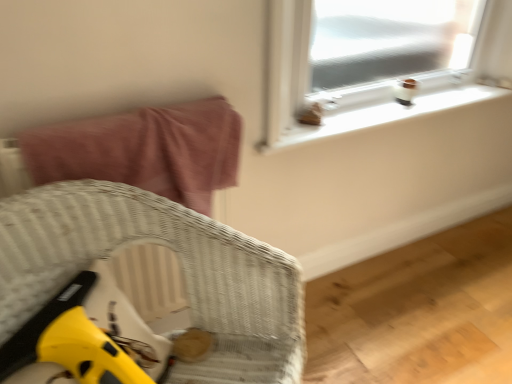
Question: Should I look upward or downward to see woven wicker chair at lower left?

Choices:
 (A) down
 (B) up

Answer: (A)

Question: From a real-world perspective, is white plastic window sill at upper right physically below pink fabric bed at upper left?

Choices:
 (A) no
 (B) yes

Answer: (B)

Question: Is white plastic window sill at upper right to the right of pink fabric bed at upper left from the viewer's perspective?

Choices:
 (A) no
 (B) yes

Answer: (B)

Question: From the image's perspective, is white plastic window sill at upper right over pink fabric bed at upper left?

Choices:
 (A) yes
 (B) no

Answer: (A)

Question: Considering the relative sizes of white plastic window sill at upper right and pink fabric bed at upper left in the image provided, is white plastic window sill at upper right thinner than pink fabric bed at upper left?

Choices:
 (A) no
 (B) yes

Answer: (B)

Question: Is white plastic window sill at upper right with pink fabric bed at upper left?

Choices:
 (A) no
 (B) yes

Answer: (A)

Question: Can you confirm if white plastic window sill at upper right is positioned to the left of pink fabric bed at upper left?

Choices:
 (A) no
 (B) yes

Answer: (A)

Question: Does woven wicker chair at lower left have a greater height compared to white plastic window sill at upper right?

Choices:
 (A) no
 (B) yes

Answer: (B)

Question: Considering the relative sizes of woven wicker chair at lower left and white plastic window sill at upper right in the image provided, is woven wicker chair at lower left smaller than white plastic window sill at upper right?

Choices:
 (A) yes
 (B) no

Answer: (B)

Question: From the image's perspective, is woven wicker chair at lower left located above white plastic window sill at upper right?

Choices:
 (A) yes
 (B) no

Answer: (B)

Question: From a real-world perspective, is woven wicker chair at lower left on top of white plastic window sill at upper right?

Choices:
 (A) no
 (B) yes

Answer: (A)

Question: Could you tell me if woven wicker chair at lower left is facing white plastic window sill at upper right?

Choices:
 (A) no
 (B) yes

Answer: (A)

Question: Is the surface of woven wicker chair at lower left in direct contact with white plastic window sill at upper right?

Choices:
 (A) yes
 (B) no

Answer: (B)

Question: Can you confirm if pink fabric bed at upper left is shorter than white plastic window sill at upper right?

Choices:
 (A) no
 (B) yes

Answer: (A)